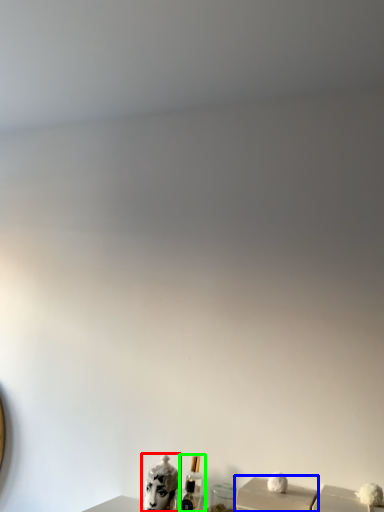
Question: Which object is positioned farthest from animal (highlighted by a red box)? Select from box (highlighted by a blue box) and perfume (highlighted by a green box).

Choices:
 (A) box
 (B) perfume

Answer: (A)